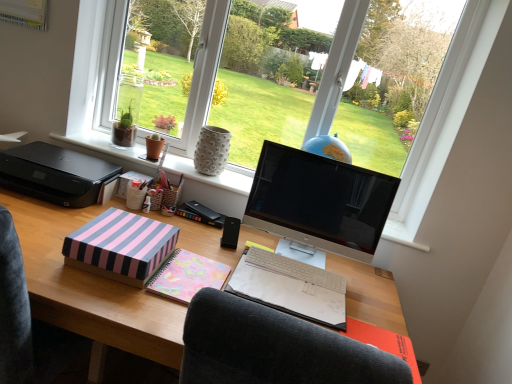
You are a GUI agent. You are given a task and a screenshot of the screen. Output one action in this format:
    pyautogui.click(x=<x>, y=<y>)
    Task: Click on the free space above white plastic keyboard at center (from a real-world perspective)
    The width and height of the screenshot is (512, 384).
    Given the screenshot: What is the action you would take?
    pyautogui.click(x=300, y=266)